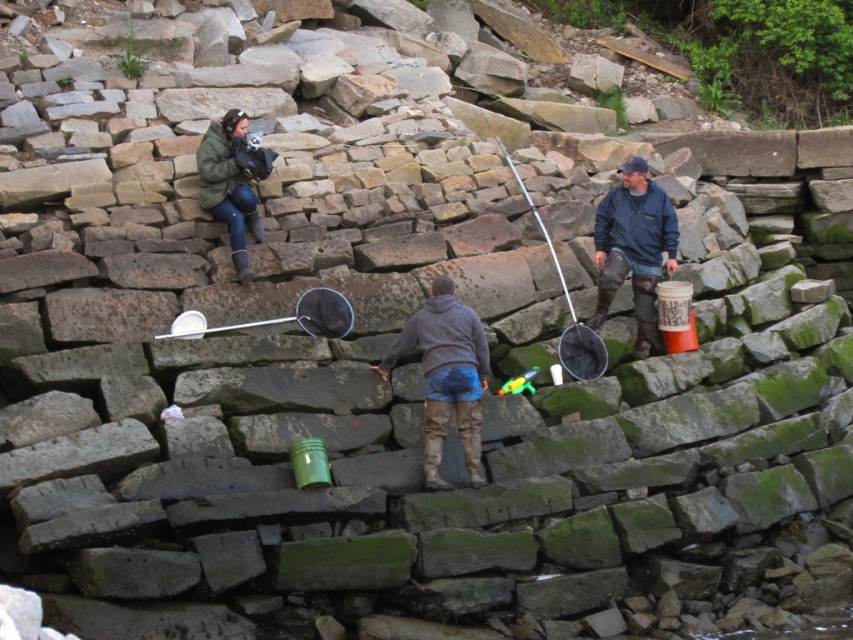
Is gray fleece jacket at center bigger than green matte jacket at upper left?

Yes.

Which is more to the left, gray fleece jacket at center or green matte jacket at upper left?

green matte jacket at upper left is more to the left.

Does point (434, 406) lie in front of point (213, 216)?

Yes, it is.

Where is `gray fleece jacket at center`? This screenshot has width=853, height=640. gray fleece jacket at center is located at coordinates (445, 376).

Between blue fleece jacket at center and green matte jacket at upper left, which one appears on the left side from the viewer's perspective?

green matte jacket at upper left

Does blue fleece jacket at center appear on the left side of green matte jacket at upper left?

No, blue fleece jacket at center is not to the left of green matte jacket at upper left.

Find the location of a particular element. blue fleece jacket at center is located at coordinates (633, 248).

Identify the location of blue fleece jacket at center. (633, 248).

Based on the photo, is gray fleece jacket at center wider than blue fleece jacket at center?

Yes.

Between gray fleece jacket at center and blue fleece jacket at center, which one appears on the right side from the viewer's perspective?

blue fleece jacket at center

In order to click on gray fleece jacket at center in this screenshot , I will do `click(445, 376)`.

At what (x,y) coordinates should I click in order to perform the action: click on gray fleece jacket at center. Please return your answer as a coordinate pair (x, y). Image resolution: width=853 pixels, height=640 pixels. Looking at the image, I should click on tap(445, 376).